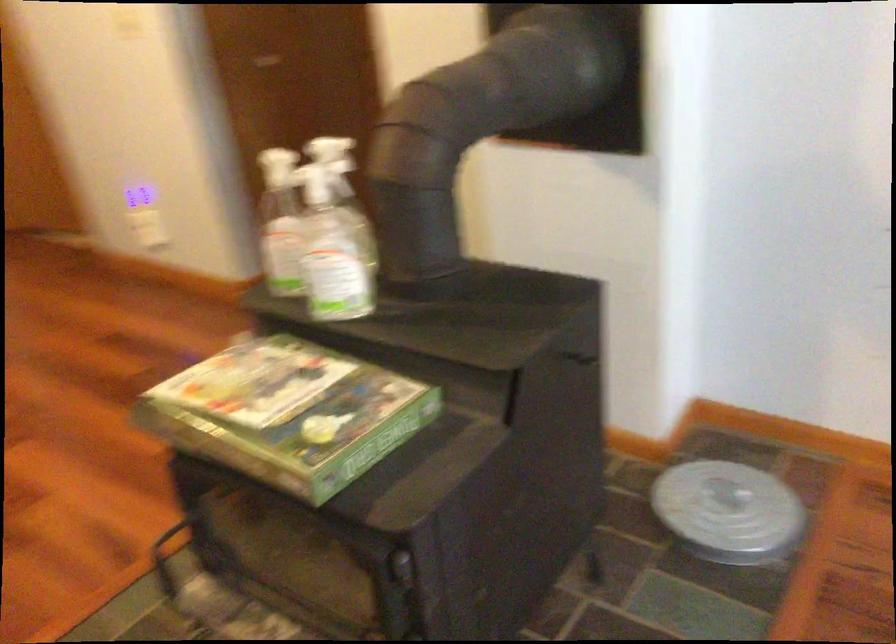
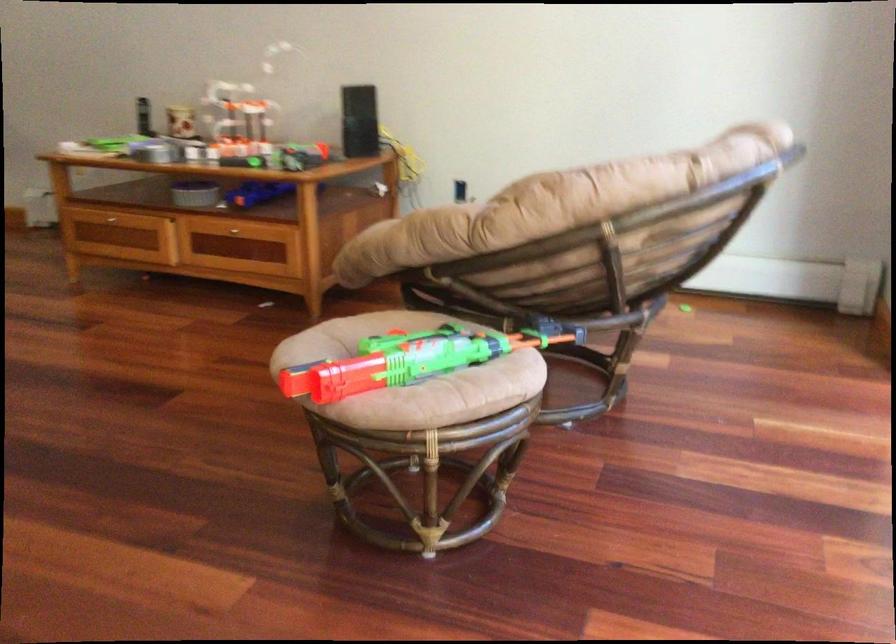
The images are taken continuously from a first-person perspective. In which direction are you moving?

The cameraman walked toward right, backward.